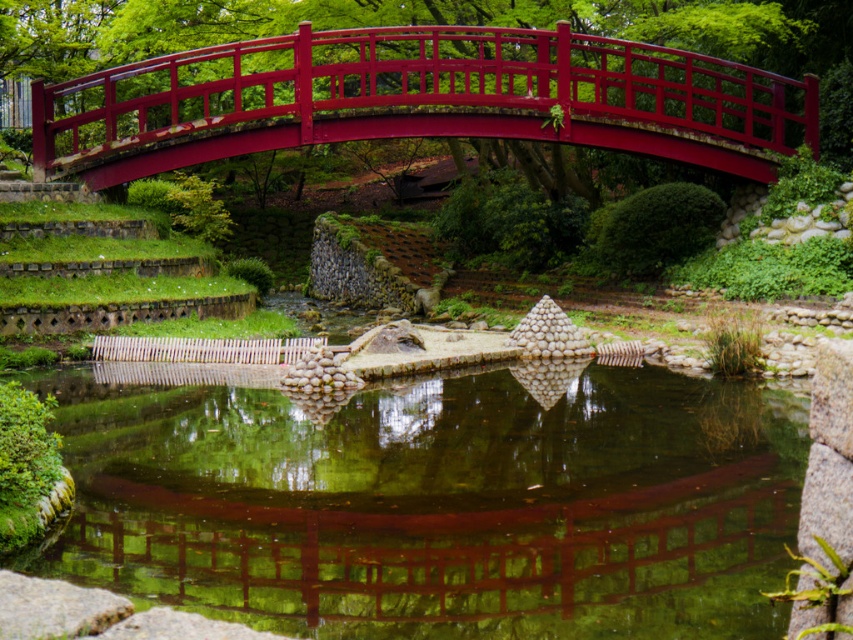
Question: Does green reflective water at center have a larger size compared to glossy wood bridge at upper center?

Choices:
 (A) yes
 (B) no

Answer: (B)

Question: Which point is farther to the camera?

Choices:
 (A) green reflective water at center
 (B) glossy wood bridge at upper center

Answer: (B)

Question: Does green reflective water at center have a greater width compared to glossy wood bridge at upper center?

Choices:
 (A) yes
 (B) no

Answer: (B)

Question: Which point appears closest to the camera in this image?

Choices:
 (A) (99, 180)
 (B) (86, 576)

Answer: (B)

Question: In this image, where is green reflective water at center located relative to glossy wood bridge at upper center?

Choices:
 (A) above
 (B) below

Answer: (B)